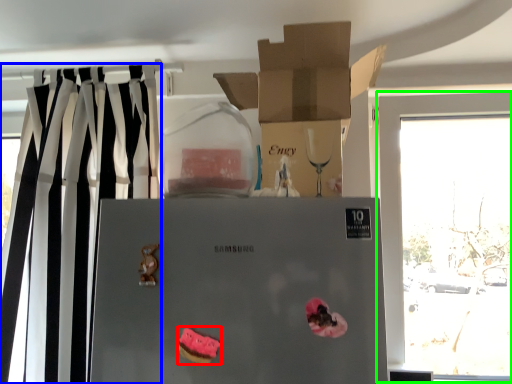
Question: Which is farther away from stuff (highlighted by a red box)? curtain (highlighted by a blue box) or window (highlighted by a green box)?

Choices:
 (A) curtain
 (B) window

Answer: (B)